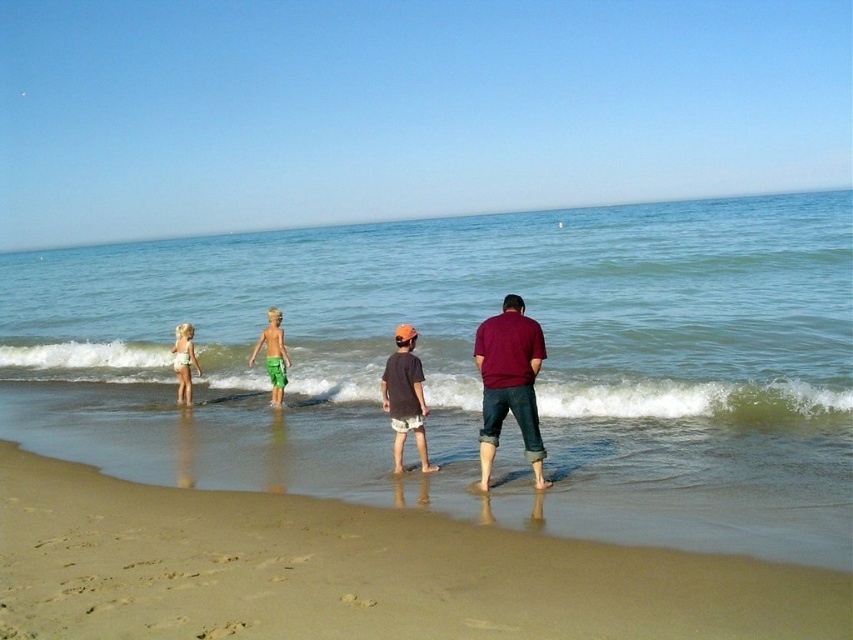
You are planning to take a photo of the clear blue water at center and the green cotton shorts at center from the beach. Which object will appear wider in the photo?

The clear blue water at center will appear wider in the photo because its width is larger than that of the green cotton shorts at center.